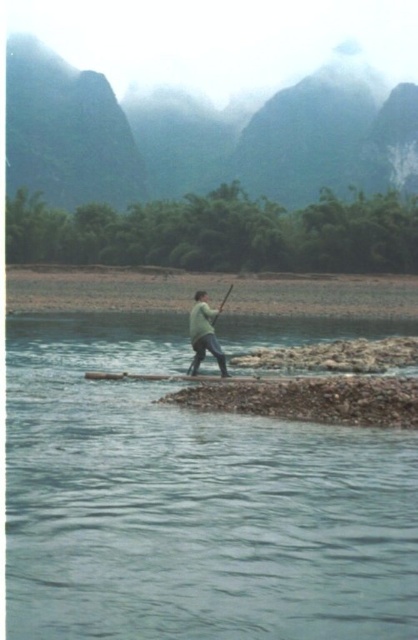
You are a kayaker planning to cross the river using the green matte paddle at center. The clear water at center is where you need to navigate. Considering the width of the paddle and the water, will the paddle be sufficient to effectively steer through the water?

The clear water at center is wider than the green matte paddle at center, so the paddle may not be sufficient to effectively steer through the entire width of the water. A wider paddle or additional tools might be needed for better control.

You are a hiker who has just reached the riverbank. You need to cross the river to continue your journey. The raft is at the edge of the river. Where should you place the raft to reach the clear water at center?

The clear water at center is located at point 2D coordinates of (191, 502). Therefore, you should place the raft at the edge closest to these coordinates to reach the clear water at center.